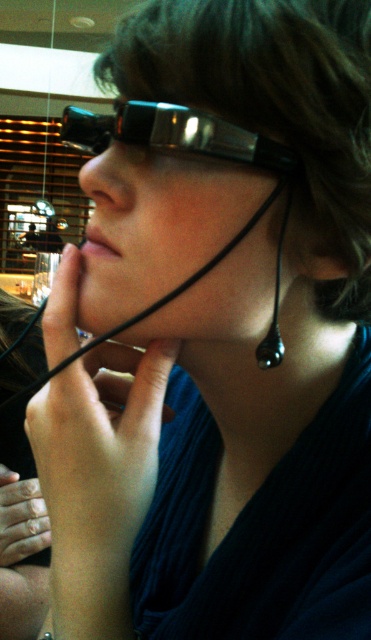
You are a designer trying to create a pair of glasses that can be worn alongside an earring. Given the scene, will the black glossy glasses at center and the black glossy earring at lower right fit comfortably without overlapping each other?

The black glossy glasses at center are wider than the black glossy earring at lower right, so they can be worn together comfortably without overlapping since their widths allow enough space between them.

Based on the photo, you are a photographer trying to capture a close shot of the black glossy glasses at center and the black glossy earring at lower right. Which object should you focus on first to ensure both are in focus without moving the camera?

You should focus on the black glossy glasses at center first because it is closer to the viewer than the black glossy earring at lower right. By focusing on the closer object, the earring will fall into the depth of field and remain sharp.

You are a fashion designer observing the image and want to ensure the black glossy earring at lower right is visible. Given the positioning of the black glossy glasses at center, is there a risk that the glasses might block the view of the earring?

The black glossy glasses at center are located above the black glossy earring at lower right, so they are positioned in a way that could potentially block the view of the earring depending on the angle, but since the earring is at lower right, it might still be visible from certain perspectives.